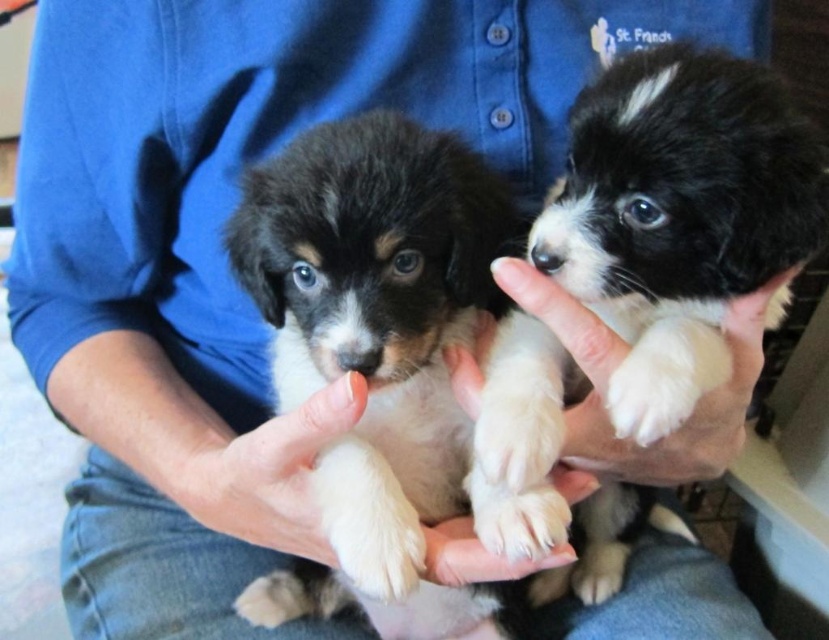
Does point (582, 323) come farther from viewer compared to point (255, 484)?

No.

Who is more forward, (454, 392) or (321, 442)?

Point (321, 442)

Locate an element on the screen. This screenshot has height=640, width=829. white soft skin at upper center is located at coordinates (619, 362).